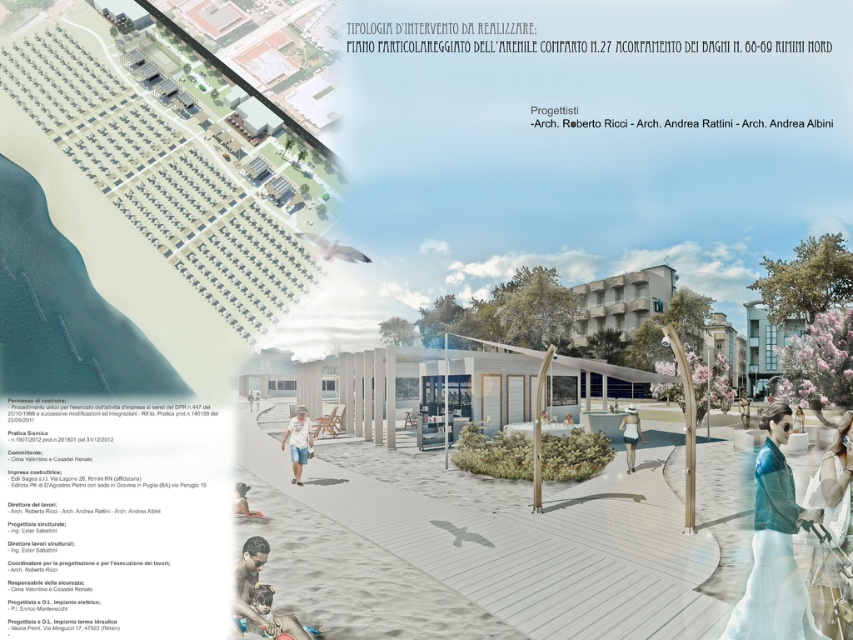
The width and height of the screenshot is (853, 640). Describe the element at coordinates (834, 477) in the screenshot. I see `white cotton dress at lower right` at that location.

Who is higher up, white cotton dress at lower right or white fabric umbrella at center?

white cotton dress at lower right is higher up.

Between point (821, 566) and point (743, 412), which one is positioned behind?

The point (743, 412) is more distant.

Image resolution: width=853 pixels, height=640 pixels. Find the location of `white cotton dress at lower right`. white cotton dress at lower right is located at coordinates (834, 477).

Describe the element at coordinates (248, 579) in the screenshot. This screenshot has height=640, width=853. I see `watercolor skin at lower left` at that location.

Does watercolor skin at lower left have a lesser height compared to matte white sand at lower center?

Incorrect, watercolor skin at lower left's height does not fall short of matte white sand at lower center's.

Find the location of a particular element. watercolor skin at lower left is located at coordinates (248, 579).

Who is lower down, denim jacket at lower right or white matte swimsuit at center?

white matte swimsuit at center is lower down.

Which is more to the left, denim jacket at lower right or white matte swimsuit at center?

Positioned to the left is denim jacket at lower right.

Between point (740, 604) and point (624, 428), which one is positioned in front?

Point (740, 604) is more forward.

Locate an element on the screen. The width and height of the screenshot is (853, 640). denim jacket at lower right is located at coordinates (775, 547).